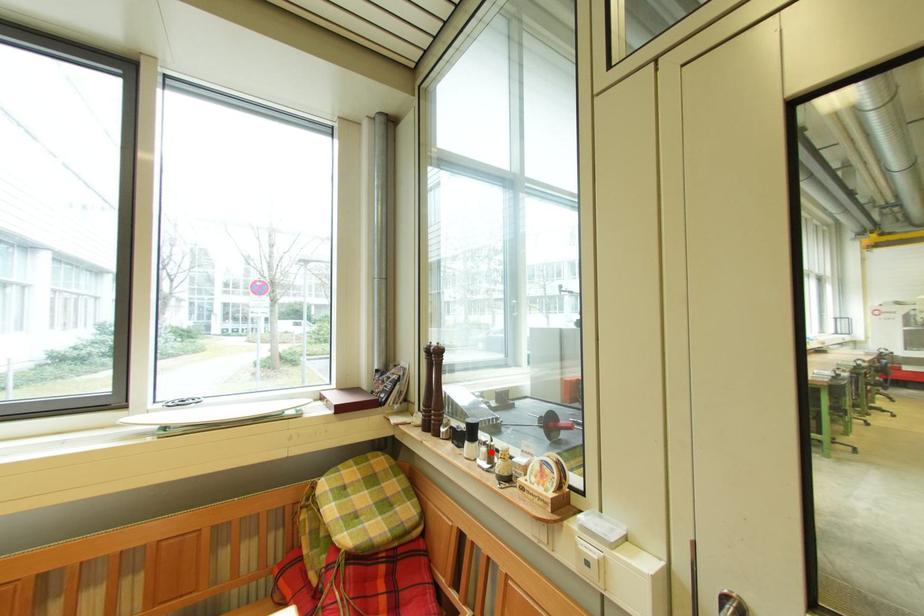
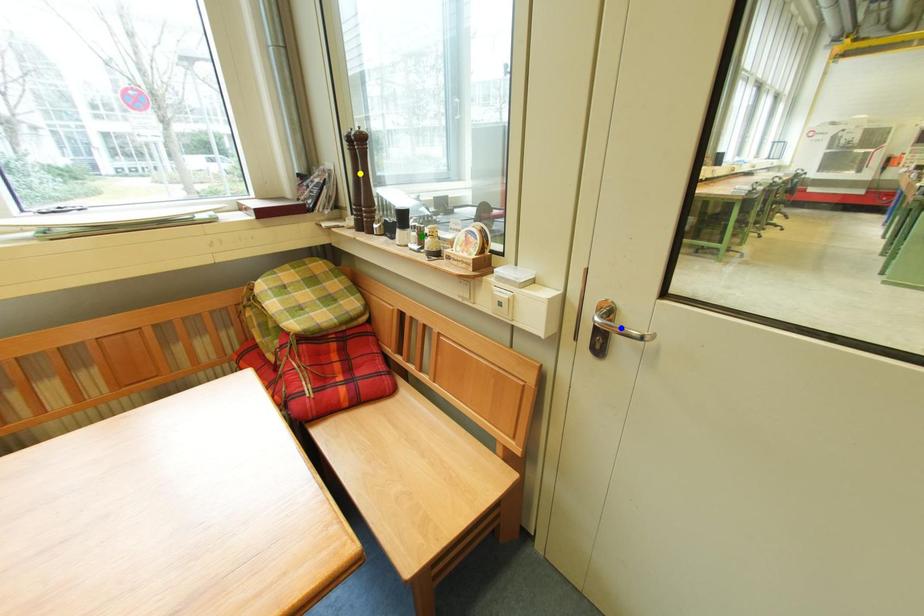
Question: I am providing you with two images of the same scene from different viewpoints. A red point is marked on the first image. You are given multiple points on the second image. In image 2, which mark is for the same physical point as the one in image 1?

Choices:
 (A) blue point
 (B) yellow point
 (C) green point

Answer: (C)